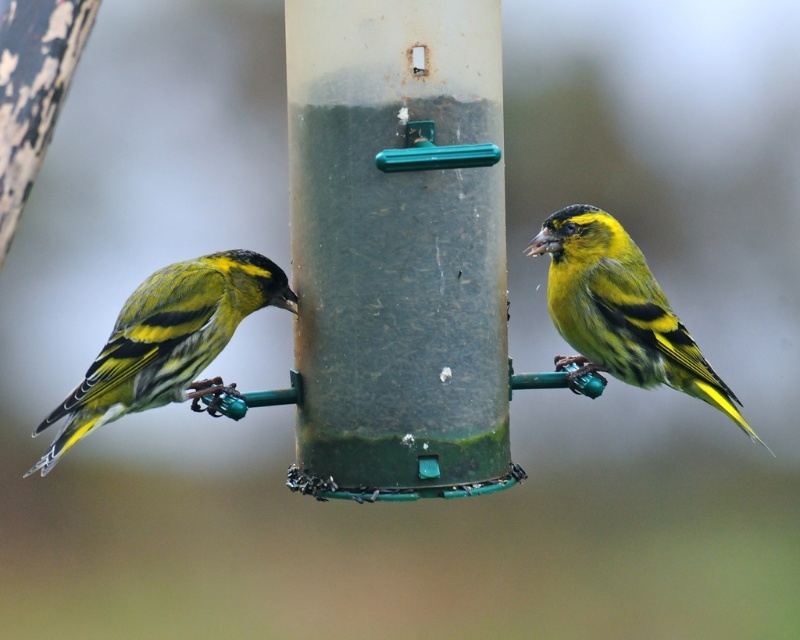
You are a photographer trying to capture a closeup of the green textured finch at left. The green matte pole at center is blocking the view. Can you determine if you can move the pole to the side to get a clear shot without moving the finch?

A: The green matte pole at center is taller than green textured finch at left, so moving the pole might be necessary to get a clear shot. However, since the pole is taller, it might be more challenging to move it out of the way without disturbing the finch.